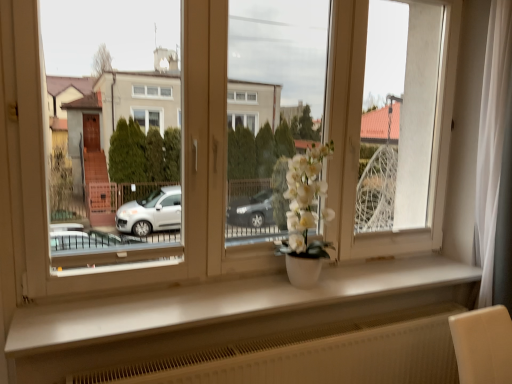
I want to click on vacant space to the right of white matte vase at center, so [x=350, y=283].